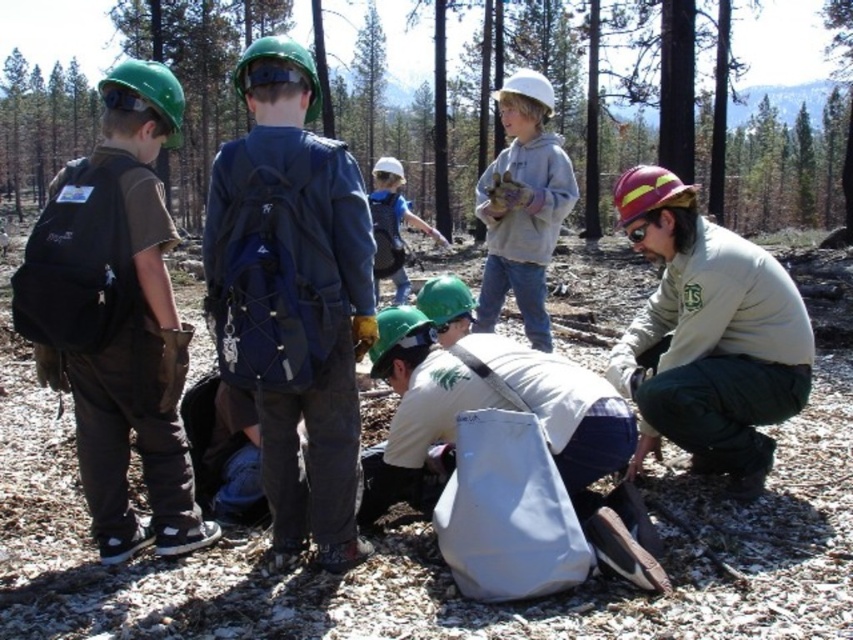
You are a safety inspector assessing the scene. You notice the brown textured dirt at center and the green helmeted person at lower right. Which object is higher in elevation?

The brown textured dirt at center is much taller than the green helmeted person at lower right, so the brown textured dirt at center is higher in elevation.